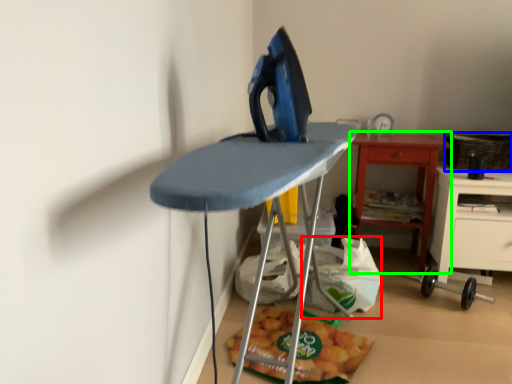
Question: Which object is the farthest from grocery bag (highlighted by a red box)? Choose among these: basket (highlighted by a blue box) or table (highlighted by a green box).

Choices:
 (A) basket
 (B) table

Answer: (A)